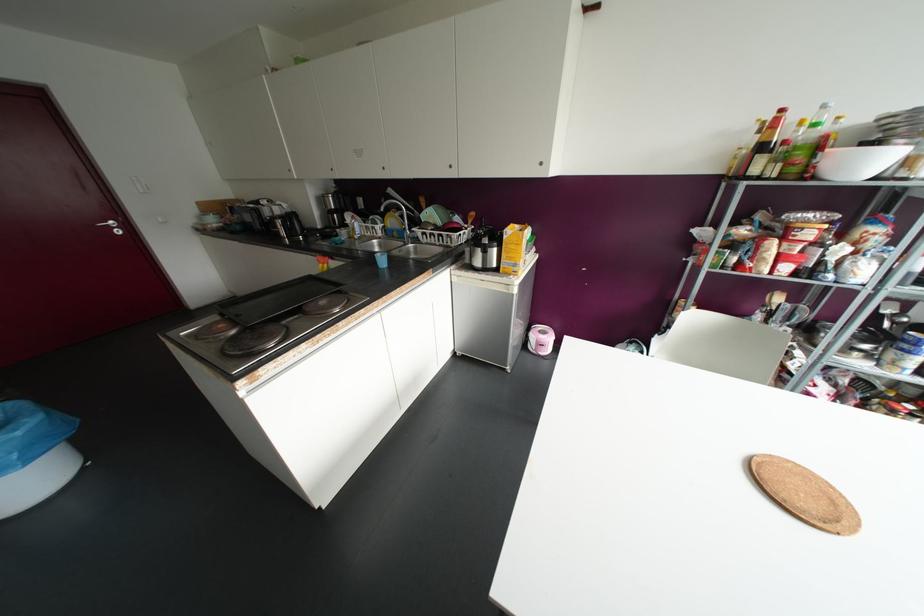
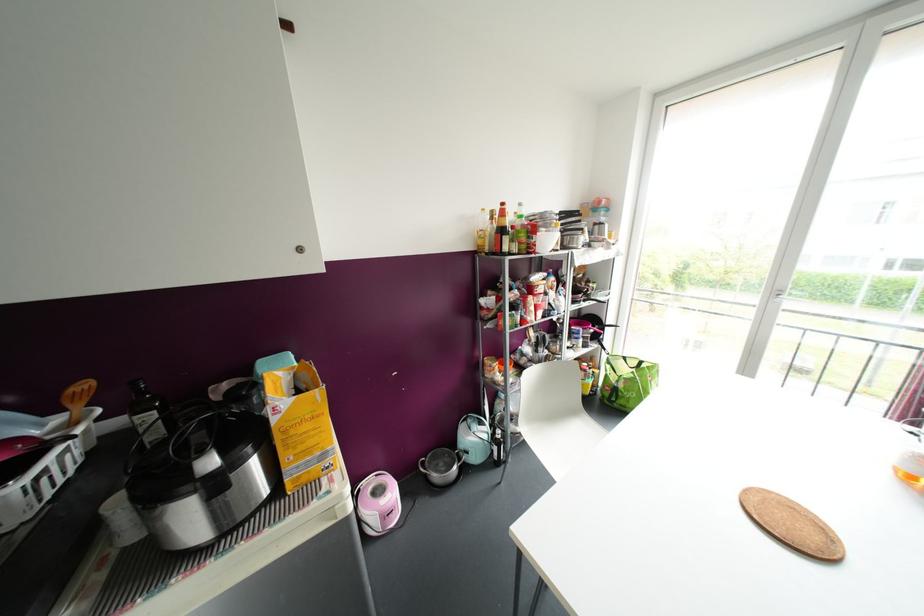
Where in the second image is the point corresponding to [548,338] from the first image?

(392, 493)